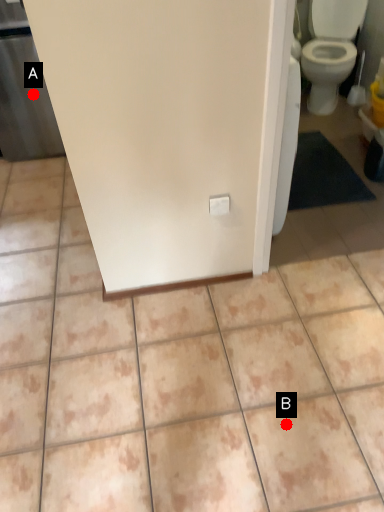
Question: Two points are circled on the image, labeled by A and B beside each circle. Which point is closer to the camera?

Choices:
 (A) A is closer
 (B) B is closer

Answer: (B)